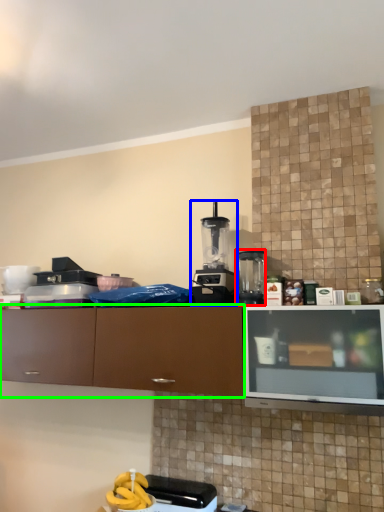
Question: Estimate the real-world distances between objects in this image. Which object is farther from kitchen appliance (highlighted by a red box), kitchen appliance (highlighted by a blue box) or cabinetry (highlighted by a green box)?

Choices:
 (A) kitchen appliance
 (B) cabinetry

Answer: (B)